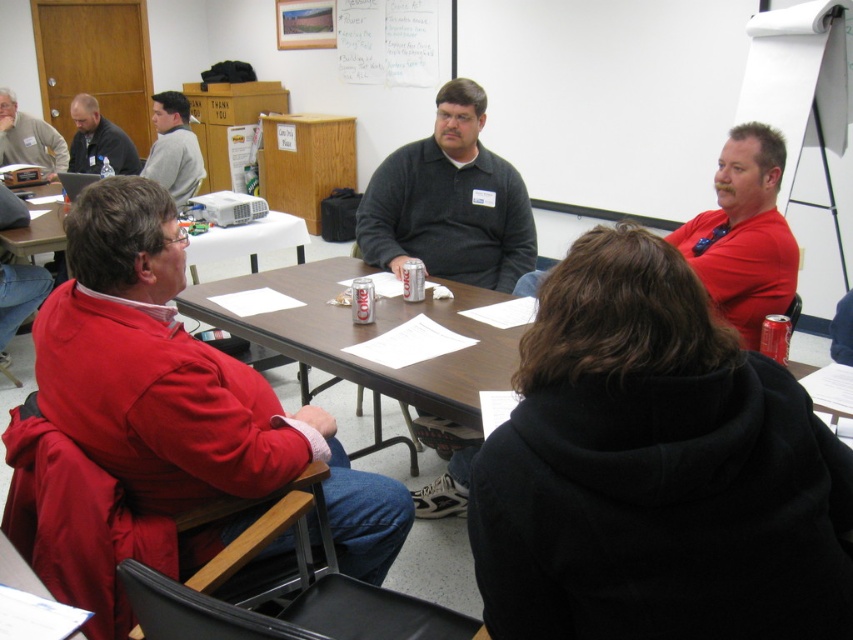
You are standing in the meeting room and see two points marked on the wall. The first point is at coordinates point (88, 426) and the second point is at point (705, 250). Which point is closer to you?

Point (88, 426) is closer to the viewer than point (705, 250).

You are a photographer trying to capture a group photo of the dark gray sweater at center and the red matte shirt at right. Since you want to ensure both subjects are in focus, you need to know their heights. Which person is taller?

The dark gray sweater at center is taller than the red matte shirt at right, so you should adjust the camera angle to account for their height difference to ensure both are in focus.

You are attending a meeting in the room and need to pass a note to the person wearing the dark gray sweater at center without alerting the person in the gray sweater at upper left. Which direction should you move to avoid their line of sight?

The dark gray sweater at center is below the gray sweater at upper left, so moving to the right or left side of the table would help avoid the gray sweater at upper left line of sight while reaching the dark gray sweater at center.